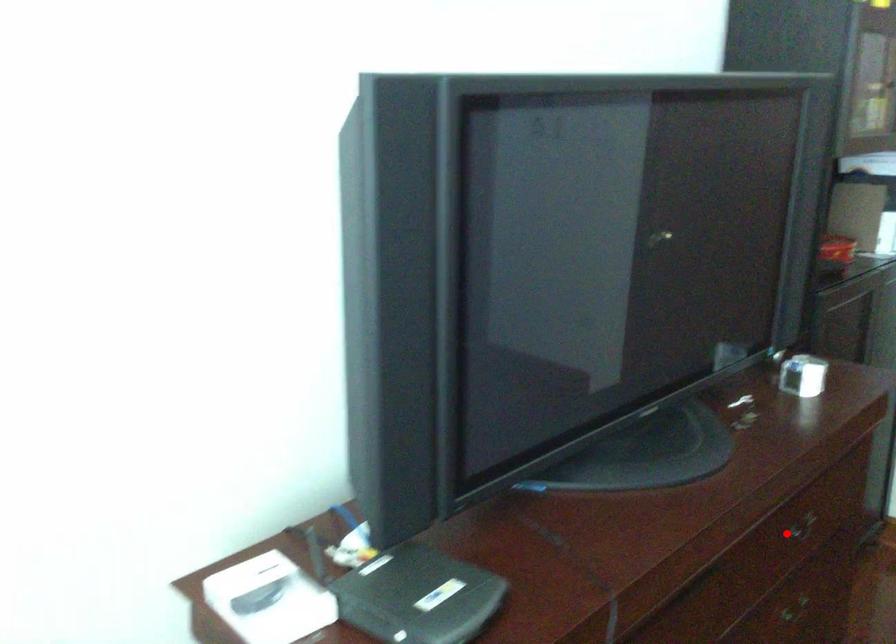
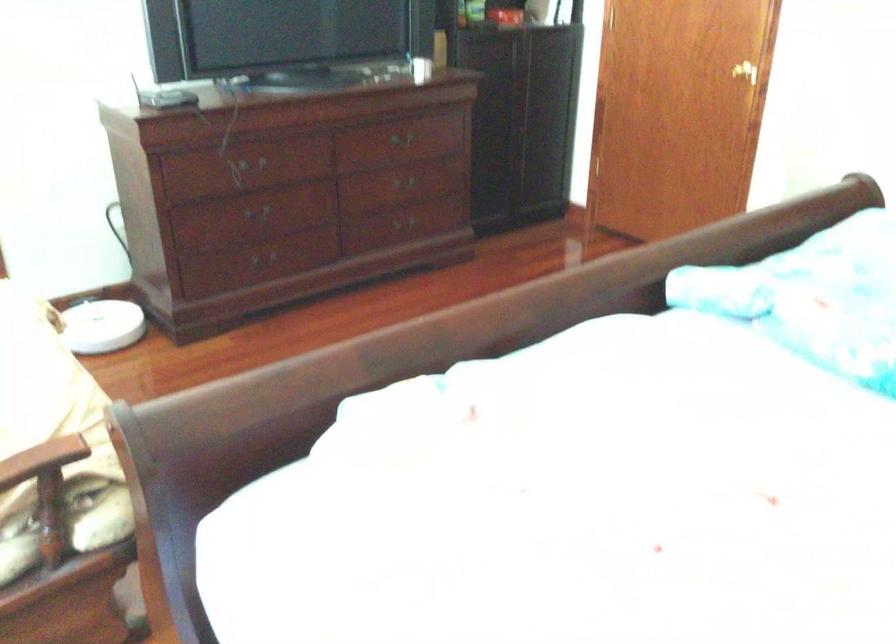
Question: I am providing you with two images of the same scene from different viewpoints. A red point is marked on the first image. Can you still see the location of the red point in image 2?

Choices:
 (A) Yes
 (B) No

Answer: (A)